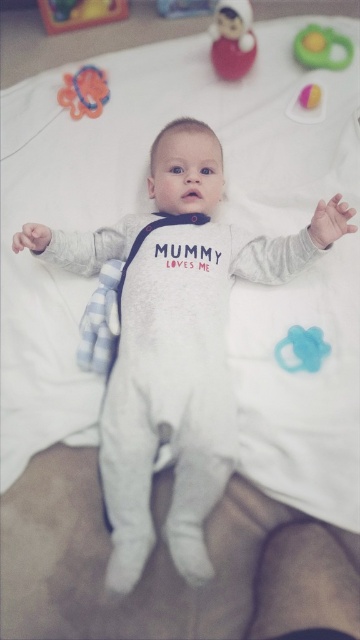
Is white soft onesie at center to the right of rubberized orange ring at upper left from the viewer's perspective?

Yes, white soft onesie at center is to the right of rubberized orange ring at upper left.

Between white soft onesie at center and rubberized orange ring at upper left, which one is positioned higher?

rubberized orange ring at upper left is above.

This screenshot has height=640, width=360. Describe the element at coordinates (174, 340) in the screenshot. I see `white soft onesie at center` at that location.

This screenshot has height=640, width=360. I want to click on white soft onesie at center, so click(x=174, y=340).

Measure the distance from white soft onesie at center to rubberized plastic toy at upper right.

62.48 centimeters

Does white soft onesie at center have a greater height compared to rubberized plastic toy at upper right?

Indeed, white soft onesie at center has a greater height compared to rubberized plastic toy at upper right.

Which is in front, point (257, 237) or point (294, 116)?

Positioned in front is point (257, 237).

Identify the location of white soft onesie at center. (174, 340).

Which of these two, blue rubber pacifier at lower right or rubberized plastic toy at upper right, stands taller?

With more height is rubberized plastic toy at upper right.

Is blue rubber pacifier at lower right bigger than rubberized plastic toy at upper right?

No.

Which is in front, point (312, 362) or point (306, 84)?

Point (312, 362) is more forward.

The height and width of the screenshot is (640, 360). Find the location of `blue rubber pacifier at lower right`. blue rubber pacifier at lower right is located at coordinates (302, 349).